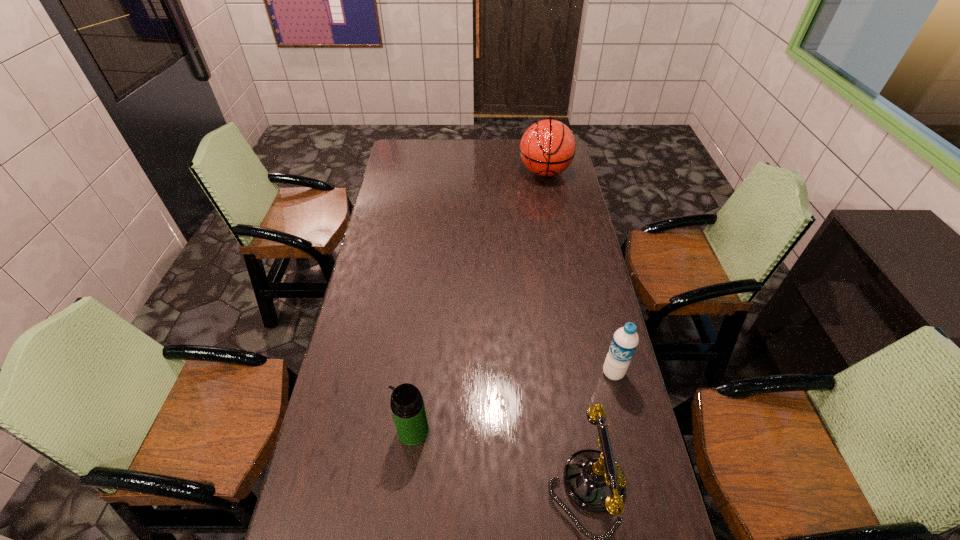
At what (x,y) coordinates should I click in order to perform the action: click on vacant region located 0.090m on the label of the second farthest object. Please return your answer as a coordinate pair (x, y). Looking at the image, I should click on (582, 392).

Locate an element on the screen. Image resolution: width=960 pixels, height=540 pixels. object situated at the far edge is located at coordinates (547, 148).

In order to click on basketball that is at the right edge in this screenshot , I will do `click(547, 148)`.

I want to click on water bottle that is positioned at the right edge, so click(x=625, y=340).

Where is `object at the far right corner`? object at the far right corner is located at coordinates (547, 148).

The width and height of the screenshot is (960, 540). Identify the location of vacant space at the far edge of the desktop. pyautogui.click(x=492, y=155).

Image resolution: width=960 pixels, height=540 pixels. In the image, there is a desktop. Find the location of `vacant space at the left edge`. vacant space at the left edge is located at coordinates (395, 273).

In order to click on blank area at the right edge in this screenshot , I will do `click(645, 468)`.

In order to click on free space between the water bottle and the basketball in this screenshot , I will do `click(579, 273)`.

The width and height of the screenshot is (960, 540). In order to click on vacant space that's between the third nearest object and the basketball in this screenshot , I will do `click(579, 273)`.